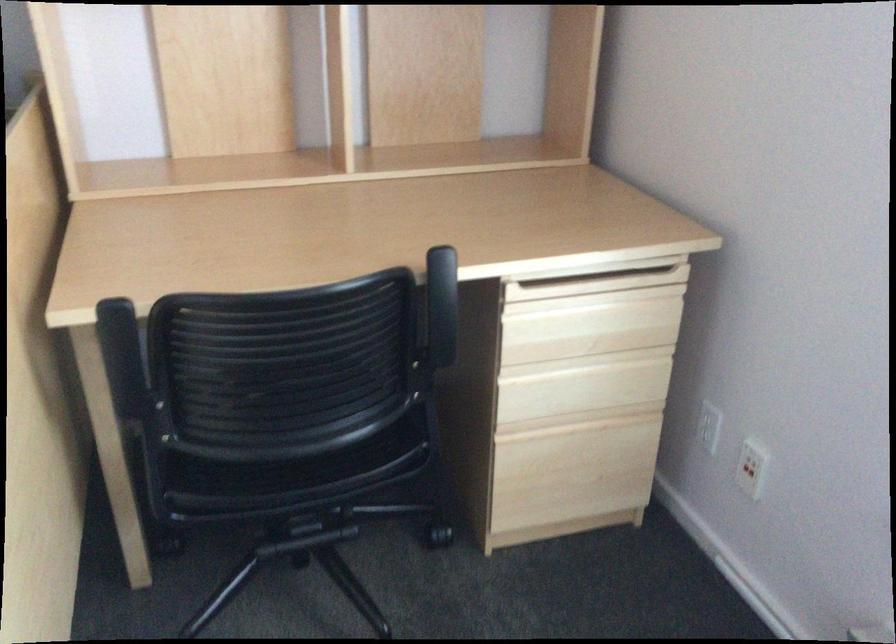
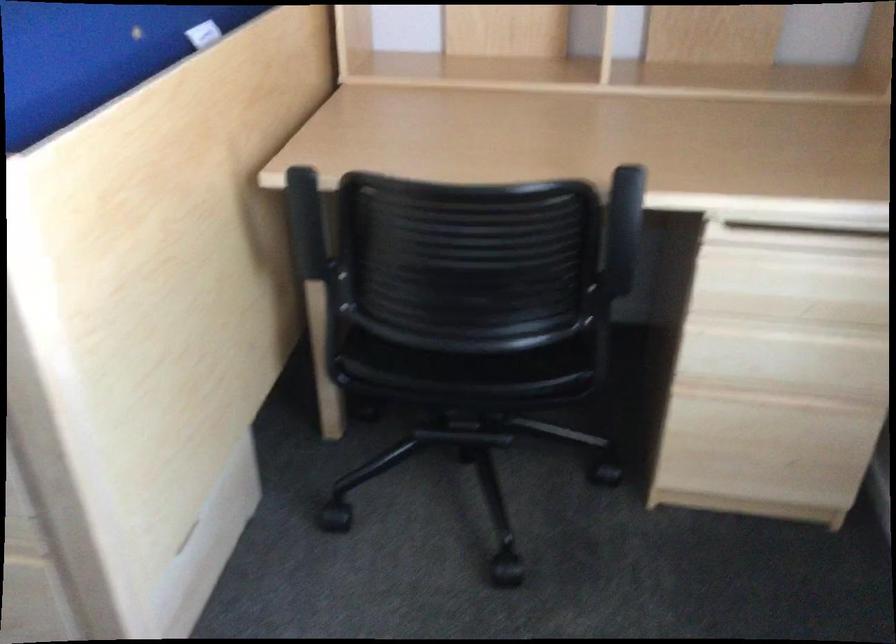
Question: In a continuous first-person perspective shot, in which direction is the camera moving?

Choices:
 (A) Left
 (B) Right
 (C) Forward
 (D) Backward

Answer: (B)